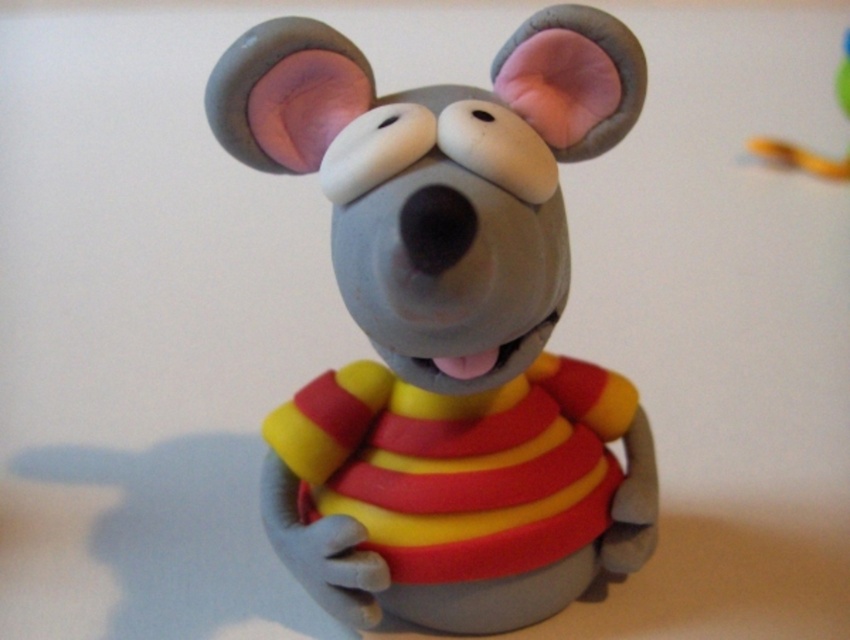
Does matte clay mouse at center have a smaller size compared to rubber yellow snake at upper right?

Actually, matte clay mouse at center might be larger than rubber yellow snake at upper right.

Can you confirm if matte clay mouse at center is taller than rubber yellow snake at upper right?

Yes.

Between point (605, 522) and point (826, 172), which one is positioned in front?

Point (605, 522) is more forward.

Where is `matte clay mouse at center`? This screenshot has width=850, height=640. matte clay mouse at center is located at coordinates (446, 328).